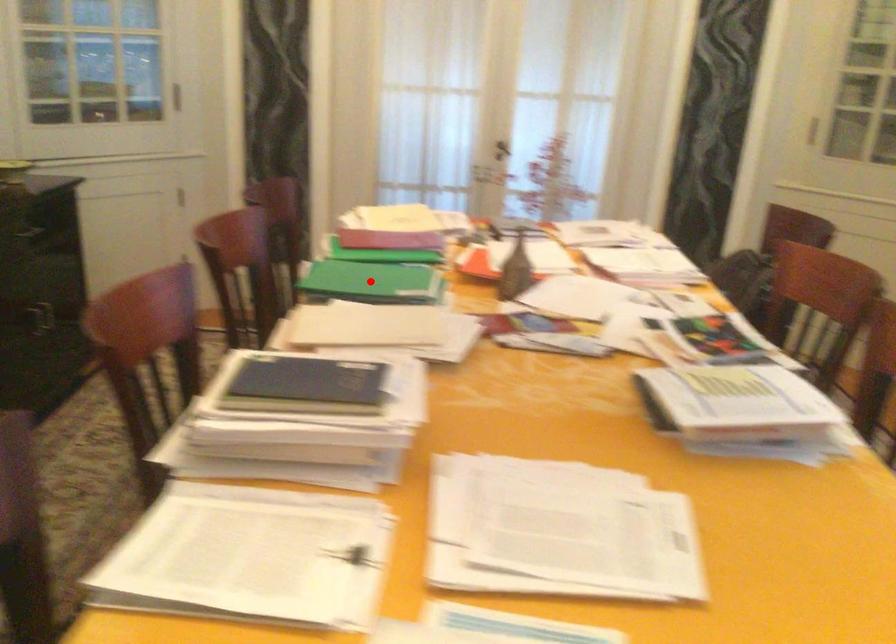
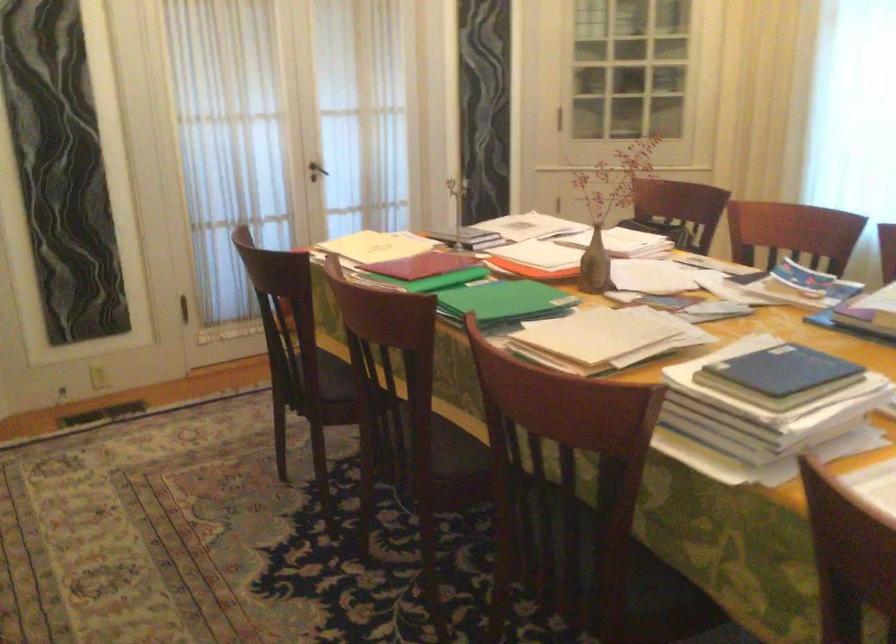
In the second image, find the point that corresponds to the highlighted location in the first image.

(504, 301)